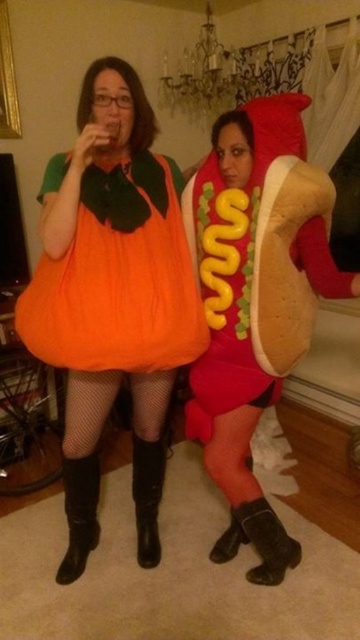
Can you confirm if matte red hot dog at center is shorter than black leather boot at lower center?

No, matte red hot dog at center is not shorter than black leather boot at lower center.

I want to click on matte red hot dog at center, so click(237, 268).

Between point (236, 211) and point (155, 536), which one is positioned in front?

Positioned in front is point (236, 211).

In order to click on matte red hot dog at center in this screenshot , I will do `click(237, 268)`.

In order to click on orange fabric dress at left in this screenshot , I will do `click(119, 282)`.

Can you confirm if matte red hot dog at center is taller than black leather boot at lower left?

Correct, matte red hot dog at center is much taller as black leather boot at lower left.

From the picture: Who is more distant from viewer, (268, 340) or (75, 538)?

Point (75, 538)

Identify the location of matte red hot dog at center. (237, 268).

Identify the location of matte red hot dog at center. The height and width of the screenshot is (640, 360). (237, 268).